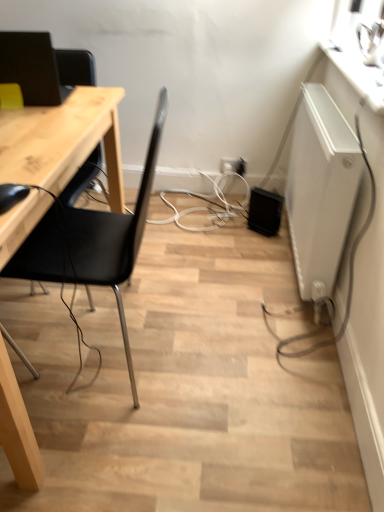
Find the location of a particular element. The image size is (384, 512). free area below black matte chair at left (from a real-world perspective) is located at coordinates (135, 336).